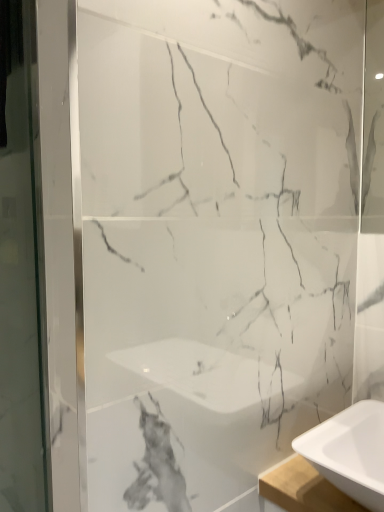
Measure the distance between white glossy sink at lower right and camera.

The depth of white glossy sink at lower right is 29.09 inches.

Locate an element on the screen. white glossy sink at lower right is located at coordinates (350, 452).

Describe the element at coordinates (350, 452) in the screenshot. I see `white glossy sink at lower right` at that location.

Describe the element at coordinates (21, 269) in the screenshot. I see `transparent glass screen door at left` at that location.

The height and width of the screenshot is (512, 384). Find the location of `transparent glass screen door at left`. transparent glass screen door at left is located at coordinates (21, 269).

Find the location of `white glossy sink at lower right`. white glossy sink at lower right is located at coordinates (350, 452).

Which is more to the left, white glossy sink at lower right or transparent glass screen door at left?

transparent glass screen door at left is more to the left.

Considering their positions, is white glossy sink at lower right located in front of or behind transparent glass screen door at left?

Visually, white glossy sink at lower right is located behind transparent glass screen door at left.

Is point (341, 484) in front of point (17, 64)?

Yes, point (341, 484) is in front of point (17, 64).

From the image's perspective, which is below, white glossy sink at lower right or transparent glass screen door at left?

white glossy sink at lower right, from the image's perspective.

From a real-world perspective, who is located lower, white glossy sink at lower right or transparent glass screen door at left?

white glossy sink at lower right, from a real-world perspective.

Based on the photo, is white glossy sink at lower right wider than transparent glass screen door at left?

Yes.

Considering the sizes of objects white glossy sink at lower right and transparent glass screen door at left in the image provided, who is shorter, white glossy sink at lower right or transparent glass screen door at left?

With less height is white glossy sink at lower right.

Can you confirm if white glossy sink at lower right is smaller than transparent glass screen door at left?

Yes.

Is white glossy sink at lower right inside or outside of transparent glass screen door at left?

white glossy sink at lower right is not enclosed by transparent glass screen door at left.

Would you consider white glossy sink at lower right to be distant from transparent glass screen door at left?

white glossy sink at lower right is positioned a significant distance from transparent glass screen door at left.

Could you tell me if white glossy sink at lower right is facing transparent glass screen door at left?

No, white glossy sink at lower right is not aimed at transparent glass screen door at left.

How different are the orientations of white glossy sink at lower right and transparent glass screen door at left in degrees?

2.74 degrees.

Locate an element on the screen. Image resolution: width=384 pixels, height=512 pixels. screen door in front of the white glossy sink at lower right is located at coordinates (21, 269).

Which is more to the right, transparent glass screen door at left or white glossy sink at lower right?

white glossy sink at lower right is more to the right.

Which object is further away from the camera, transparent glass screen door at left or white glossy sink at lower right?

white glossy sink at lower right is further away from the camera.

Which point is more distant from viewer, (x=34, y=422) or (x=359, y=441)?

The point (x=34, y=422) is behind.

From the image's perspective, which is above, transparent glass screen door at left or white glossy sink at lower right?

transparent glass screen door at left.

From a real-world perspective, is transparent glass screen door at left above or below white glossy sink at lower right?

transparent glass screen door at left is above white glossy sink at lower right.

Which object is wider, transparent glass screen door at left or white glossy sink at lower right?

Wider between the two is white glossy sink at lower right.

Who is taller, transparent glass screen door at left or white glossy sink at lower right?

transparent glass screen door at left is taller.

Who is smaller, transparent glass screen door at left or white glossy sink at lower right?

With smaller size is white glossy sink at lower right.

From the picture: Is white glossy sink at lower right inside transparent glass screen door at left?

No, white glossy sink at lower right is not a part of transparent glass screen door at left.

In the scene shown: Is transparent glass screen door at left next to white glossy sink at lower right?

No, transparent glass screen door at left is not touching white glossy sink at lower right.

Is transparent glass screen door at left oriented towards white glossy sink at lower right?

No, transparent glass screen door at left does not turn towards white glossy sink at lower right.

Can you tell me how much transparent glass screen door at left and white glossy sink at lower right differ in facing direction?

2.74 degrees separate the facing orientations of transparent glass screen door at left and white glossy sink at lower right.

Measure the distance between transparent glass screen door at left and white glossy sink at lower right.

transparent glass screen door at left and white glossy sink at lower right are 1.07 meters apart from each other.

This screenshot has width=384, height=512. What are the coordinates of `sink below the transparent glass screen door at left (from a real-world perspective)` in the screenshot? It's located at (350, 452).

Find the location of a particular element. The height and width of the screenshot is (512, 384). sink located below the transparent glass screen door at left (from the image's perspective) is located at coordinates (350, 452).

At what (x,y) coordinates should I click in order to perform the action: click on screen door above the white glossy sink at lower right (from a real-world perspective). Please return your answer as a coordinate pair (x, y). The height and width of the screenshot is (512, 384). Looking at the image, I should click on (21, 269).